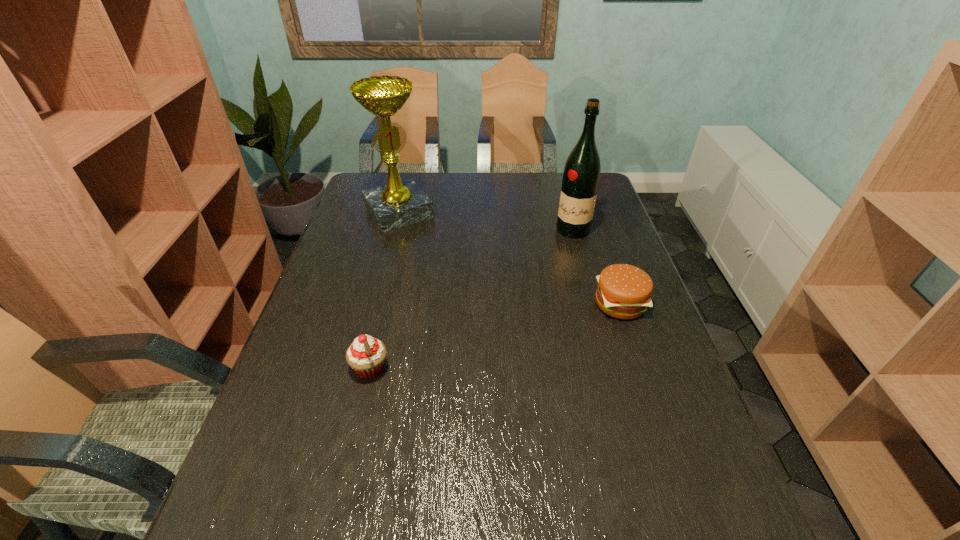
At what (x,y) coordinates should I click in order to perform the action: click on free spot that satisfies the following two spatial constraints: 1. on the front side of the liquor; 2. on the right side of the hamburger. Please return your answer as a coordinate pair (x, y). Looking at the image, I should click on (593, 303).

Find the location of a particular element. free space in the image that satisfies the following two spatial constraints: 1. on the front side of the award; 2. on the left side of the liquor is located at coordinates (394, 230).